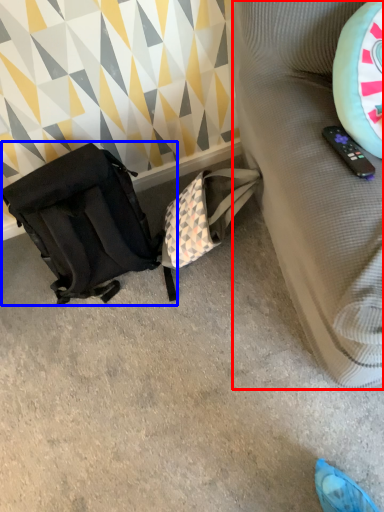
Question: Which of the following is the closest to the observer, furniture (highlighted by a red box) or luggage and bags (highlighted by a blue box)?

Choices:
 (A) furniture
 (B) luggage and bags

Answer: (A)